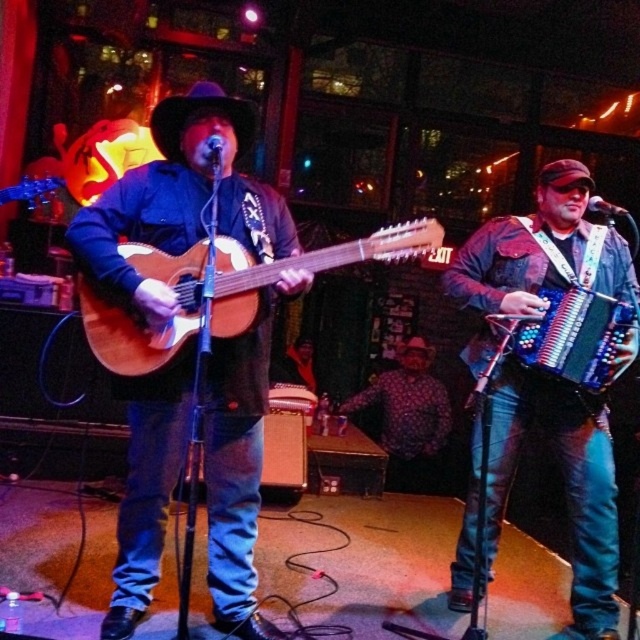
Consider the image. Which of these two, matte brown guitar at left or multicolored plastic accordion at right, stands shorter?

With less height is multicolored plastic accordion at right.

Does point (212, 577) come farther from viewer compared to point (588, 328)?

No, (212, 577) is in front of (588, 328).

Is point (80, 264) positioned behind point (531, 323)?

No, it is not.

Locate an element on the screen. matte brown guitar at left is located at coordinates point(180,200).

Does matte brown guitar at left appear on the left side of polka dot shirt at center?

Correct, you'll find matte brown guitar at left to the left of polka dot shirt at center.

Where is `matte brown guitar at left`? matte brown guitar at left is located at coordinates (180, 200).

This screenshot has height=640, width=640. Identify the location of matte brown guitar at left. (180, 200).

You are a GUI agent. You are given a task and a screenshot of the screen. Output one action in this format:
    pyautogui.click(x=<x>, y=<y>)
    Task: Click on the matte brown guitar at left
    
    Given the screenshot: What is the action you would take?
    pyautogui.click(x=180, y=200)

What do you see at coordinates (573, 336) in the screenshot? The height and width of the screenshot is (640, 640). I see `multicolored plastic accordion at right` at bounding box center [573, 336].

Find the location of a particular element. Image resolution: width=640 pixels, height=640 pixels. multicolored plastic accordion at right is located at coordinates (573, 336).